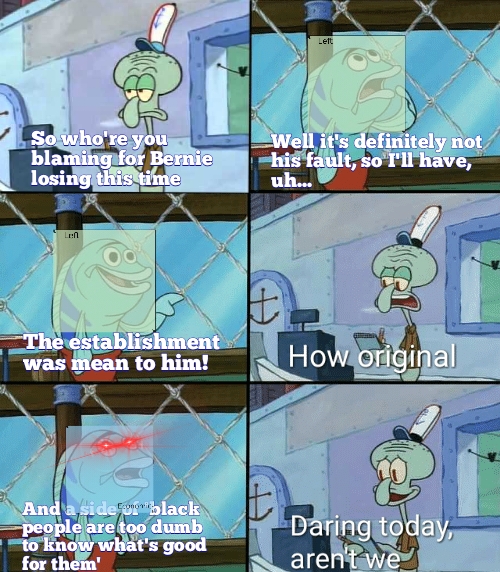
Where is `window into kitchen`? window into kitchen is located at coordinates (490, 307), (491, 484), (245, 101).